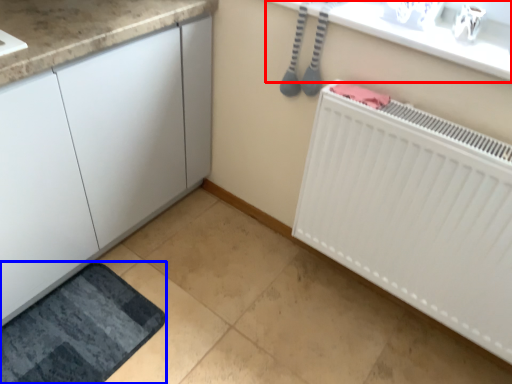
Question: Among these objects, which one is farthest to the camera, counter top (highlighted by a red box) or bath mat (highlighted by a blue box)?

Choices:
 (A) counter top
 (B) bath mat

Answer: (B)